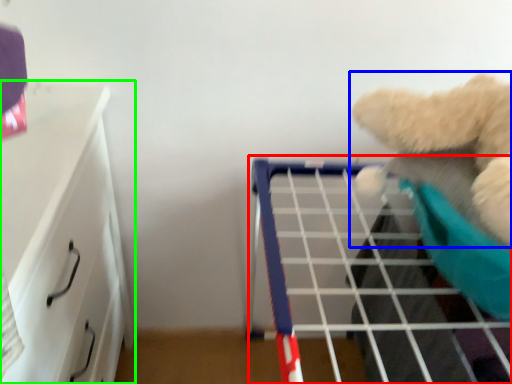
Question: Which object is positioned farthest from shelf (highlighted by a red box)? Select from teddy bear (highlighted by a blue box) and furniture (highlighted by a green box).

Choices:
 (A) teddy bear
 (B) furniture

Answer: (B)